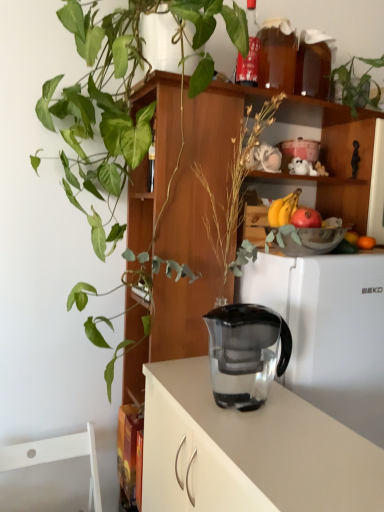
This screenshot has width=384, height=512. I want to click on blank space situated above transparent glass pitcher at center (from a real-world perspective), so click(x=277, y=419).